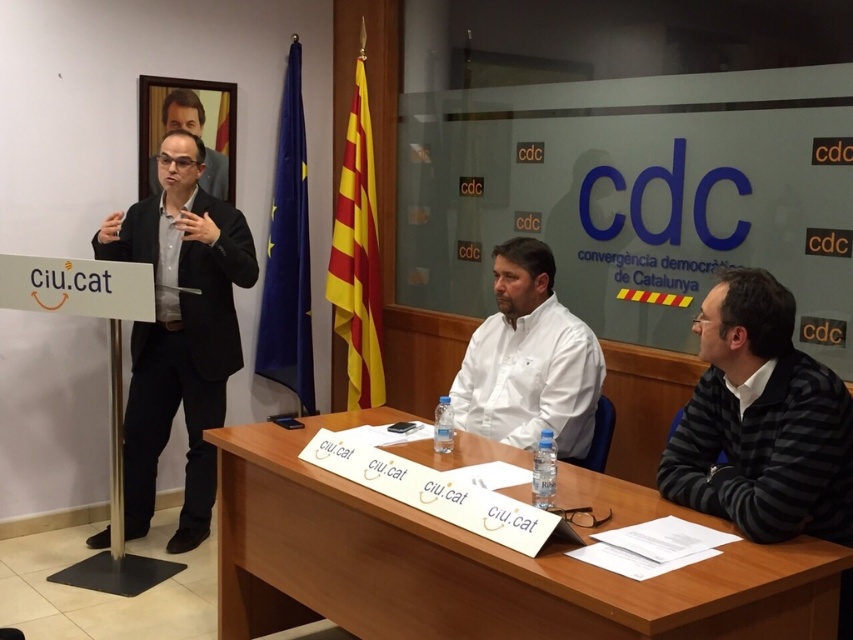
You are organizing a meeting and need to place a 1.2 meter wide banner on the light brown wooden table at center. Considering the matte black suit at upper left is already occupying space on the table, will the banner fit?

The light brown wooden table at center might be wider than the matte black suit at upper left, so there is a possibility that the banner could fit, but it depends on the exact dimensions of both the table and the occupied space by the suit.